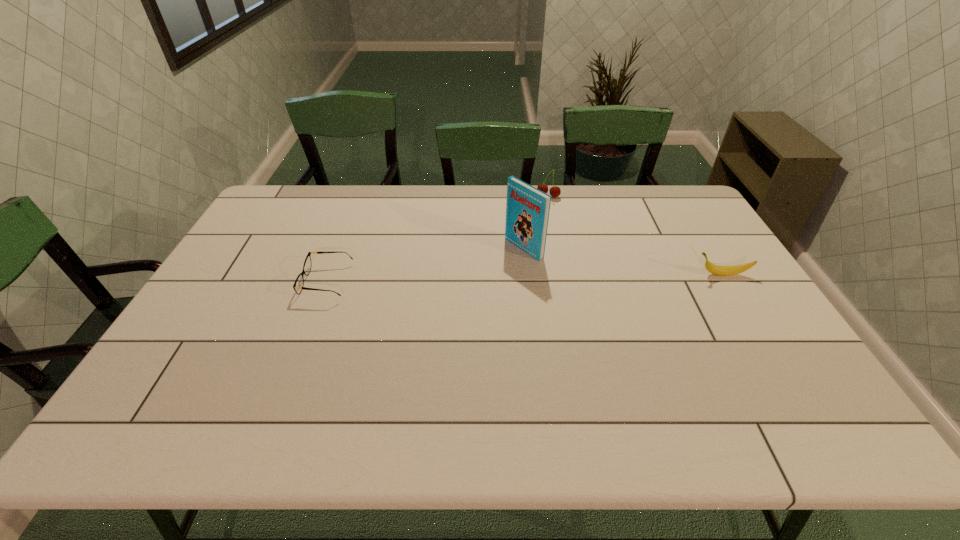
Where is `object that is positioned at the far edge`? object that is positioned at the far edge is located at coordinates (555, 191).

This screenshot has height=540, width=960. In order to click on object present at the right edge in this screenshot , I will do `click(712, 268)`.

At what (x,y) coordinates should I click in order to perform the action: click on blank area at the far edge. Please return your answer as a coordinate pair (x, y). The width and height of the screenshot is (960, 540). Looking at the image, I should click on (382, 213).

In the image, there is a desktop. Where is `vacant region at the near edge`? The height and width of the screenshot is (540, 960). vacant region at the near edge is located at coordinates (370, 392).

Where is `vacant area at the left edge of the desktop`? The width and height of the screenshot is (960, 540). vacant area at the left edge of the desktop is located at coordinates (210, 284).

I want to click on vacant space at the far left corner of the desktop, so click(304, 186).

Image resolution: width=960 pixels, height=540 pixels. What are the coordinates of `free space between the cherry and the rightmost object` in the screenshot? It's located at (636, 235).

Image resolution: width=960 pixels, height=540 pixels. What are the coordinates of `free space that is in between the third nearest object and the rightmost object` in the screenshot? It's located at (623, 261).

The image size is (960, 540). Identify the location of free space that is in between the third tallest object and the second object from right to left. (636, 235).

At what (x,y) coordinates should I click in order to perform the action: click on empty space that is in between the third object from right to left and the spectacles. Please return your answer as a coordinate pair (x, y). The image size is (960, 540). Looking at the image, I should click on (425, 265).